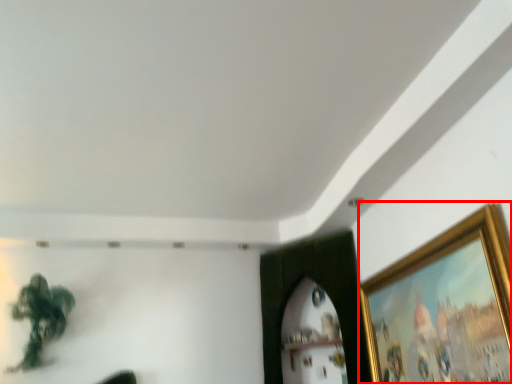
Question: From the image's perspective, where is picture frame (annotated by the red box) located in relation to plant in the image?

Choices:
 (A) above
 (B) below

Answer: (A)